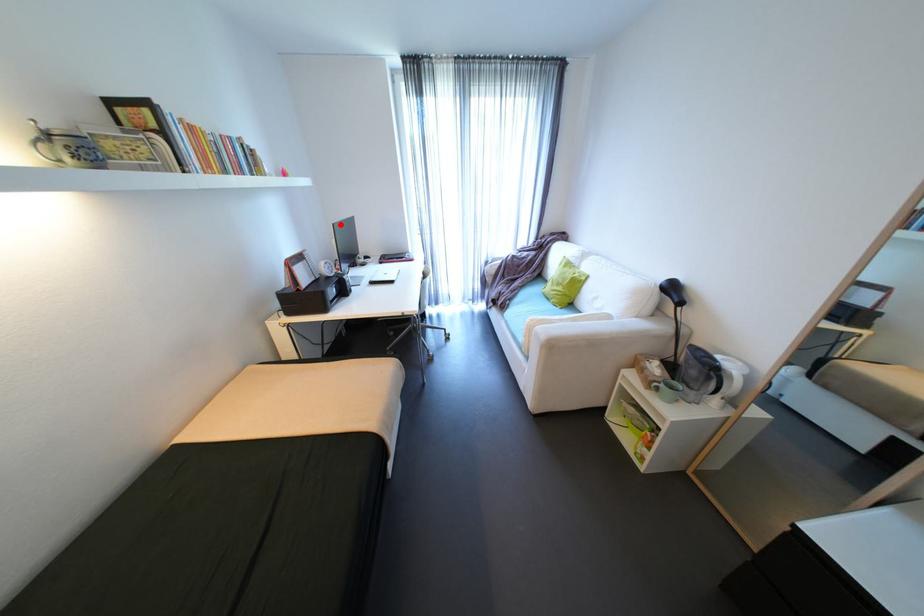
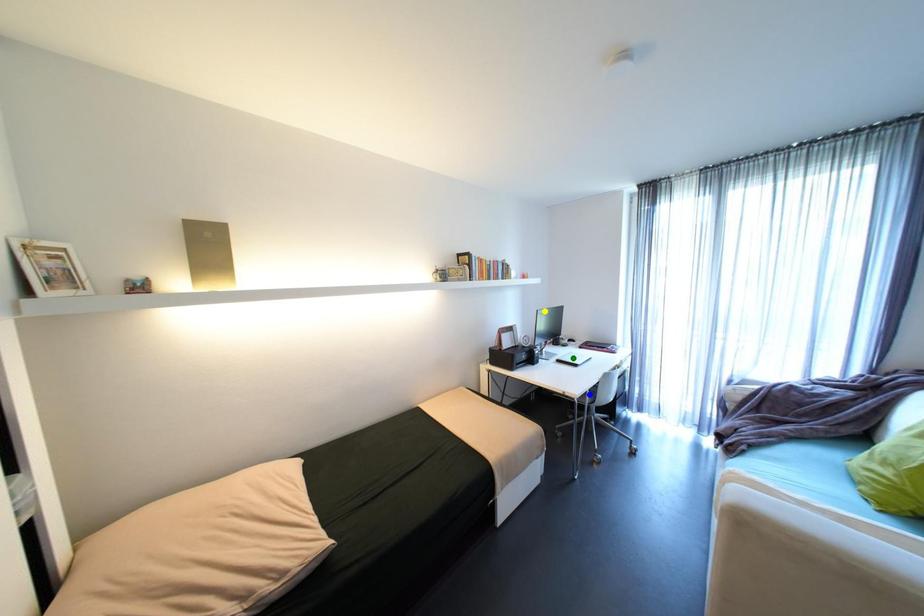
Question: I am providing you with two images of the same scene from different viewpoints. A red point is marked on the first image. You are given multiple points on the second image. Which point in image 2 represents the same 3d spot as the red point in image 1?

Choices:
 (A) green point
 (B) yellow point
 (C) blue point

Answer: (B)